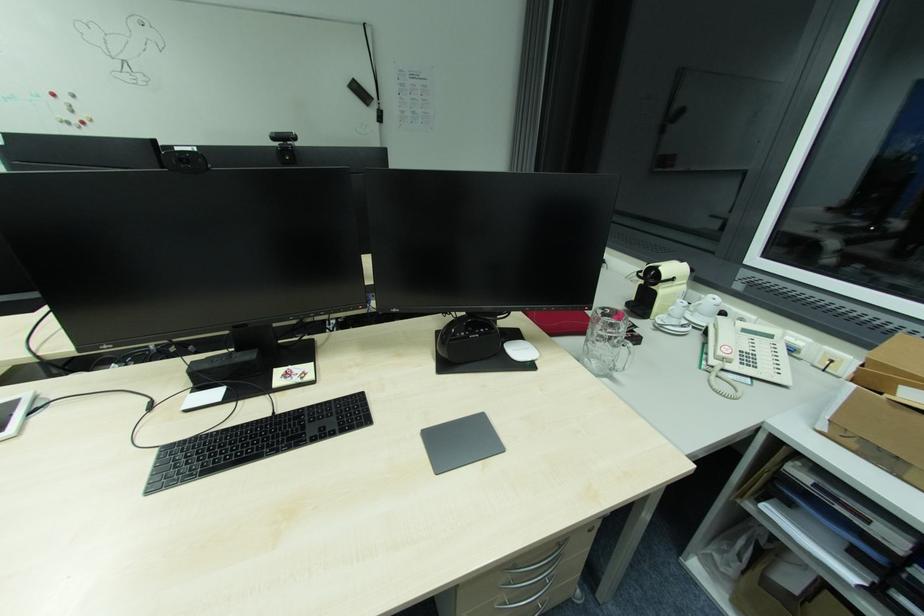
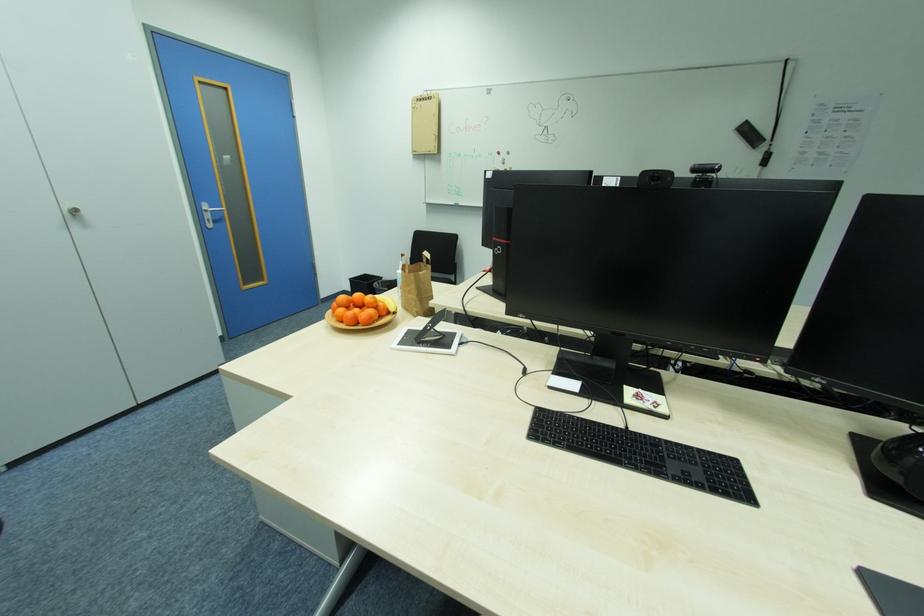
Question: Based on the continuous images, in which direction is the camera rotating? Reply with the corresponding letter.

Choices:
 (A) Left
 (B) Right
 (C) Up
 (D) Down

Answer: (A)